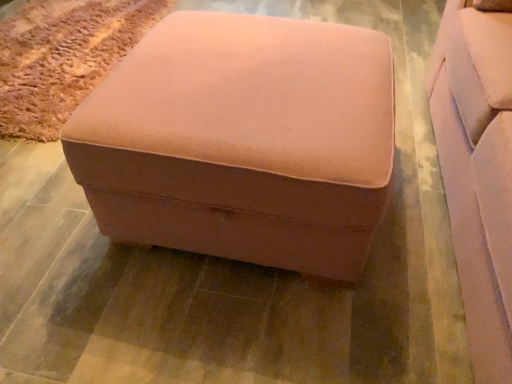
In order to face pink velvet ottoman at center, should I rotate leftwards or rightwards?

You should look left and rotate roughly 0.654 degrees.

Where is `pink velvet ottoman at center`? The width and height of the screenshot is (512, 384). pink velvet ottoman at center is located at coordinates (243, 141).

Describe the element at coordinates (243, 141) in the screenshot. The height and width of the screenshot is (384, 512). I see `pink velvet ottoman at center` at that location.

This screenshot has height=384, width=512. What are the coordinates of `pink velvet ottoman at center` in the screenshot? It's located at (243, 141).